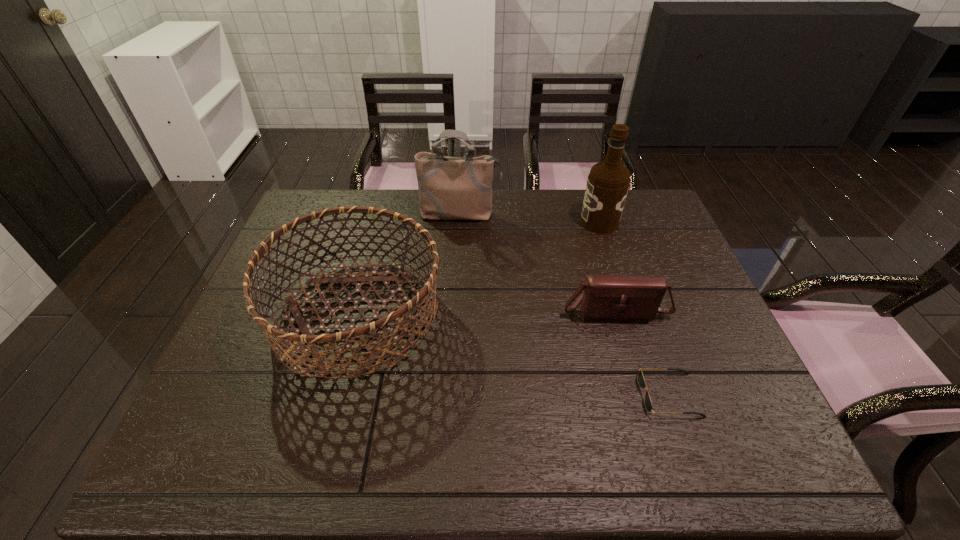
Locate an element on the screen. alcohol is located at coordinates (608, 182).

You are a GUI agent. You are given a task and a screenshot of the screen. Output one action in this format:
    pyautogui.click(x=<x>, y=<y>)
    Task: Click on the left shoulder bag
    
    Given the screenshot: What is the action you would take?
    tap(450, 188)

In order to click on the taller shoulder bag in this screenshot , I will do `click(450, 188)`.

Where is `the third tallest object`? This screenshot has width=960, height=540. the third tallest object is located at coordinates (383, 344).

Locate an element on the screen. the second shortest object is located at coordinates pyautogui.click(x=638, y=297).

At what (x,y) coordinates should I click in order to perform the action: click on the nearer shoulder bag. Please return your answer as a coordinate pair (x, y). This screenshot has height=540, width=960. Looking at the image, I should click on (638, 297).

The height and width of the screenshot is (540, 960). Identify the location of sunglasses. (641, 381).

Locate an element on the screen. free space located 0.400m on the label of the alcohol is located at coordinates (458, 222).

Locate an element on the screen. This screenshot has height=540, width=960. vacant space located 0.380m on the label of the alcohol is located at coordinates (464, 222).

Where is `vacant space located on the label of the alcohol`? vacant space located on the label of the alcohol is located at coordinates (556, 222).